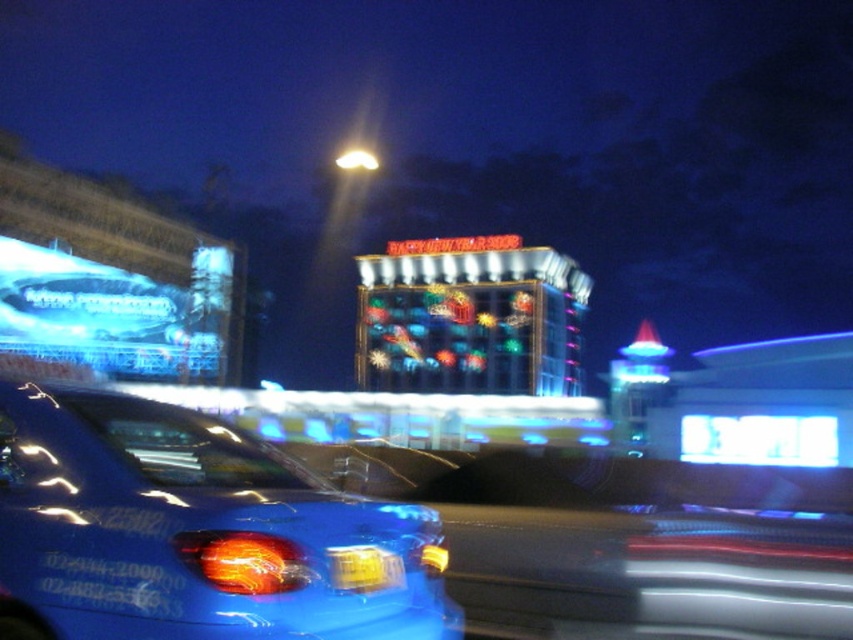
You are a pedestrian standing on the sidewalk and see the glossy blue car at lower left and the yellow plastic license plate at center. Which object is closer to the left side of the road?

The glossy blue car at lower left is positioned on the left side of the yellow plastic license plate at center, so it is closer to the left side of the road.

You are a delivery robot that is 2 meters wide. You need to navigate between the glossy blue car at lower left and the yellow plastic license plate at center. Can you fit through the space between them?

The distance between the glossy blue car at lower left and the yellow plastic license plate at center is 10.70 feet, which converts to approximately 3.26 meters. Since the robot is 2 meters wide, it can easily fit through the space between them as there is sufficient width available.

You are a drone operator trying to navigate between two points in the image. The first point is point (172, 557) and the second is point (340, 577). According to the image, which point is closer to the camera?

Point (172, 557) is in front of point (340, 577), so it is closer to the camera.